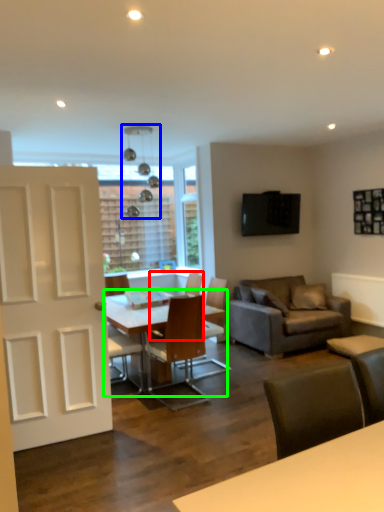
Question: Based on their relative distances, which object is nearer to chair (highlighted by a red box)? Choose from light fixture (highlighted by a blue box) and table (highlighted by a green box).

Choices:
 (A) light fixture
 (B) table

Answer: (B)